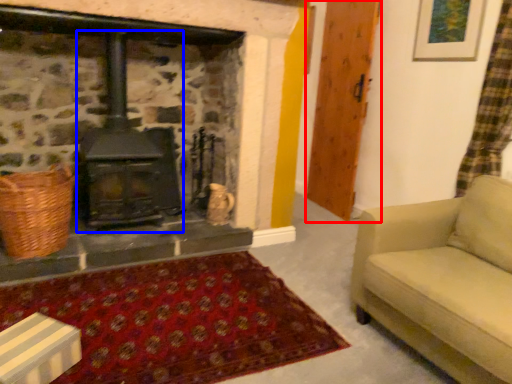
Question: Which object appears farthest to the camera in this image, wood (highlighted by a red box) or wood burning stove (highlighted by a blue box)?

Choices:
 (A) wood
 (B) wood burning stove

Answer: (A)